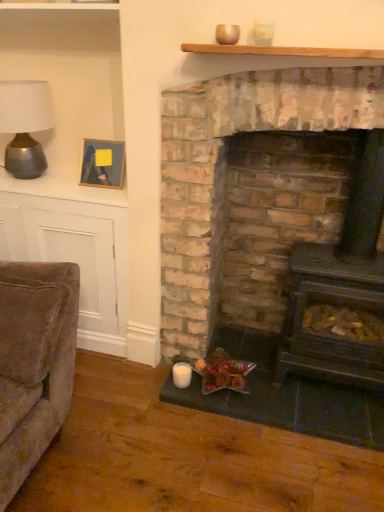
Image resolution: width=384 pixels, height=512 pixels. In order to click on free spot to the right of matte silver table lamp at left in this screenshot , I will do `click(67, 185)`.